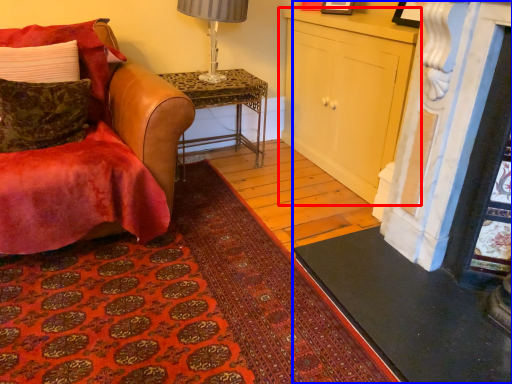
Question: Which point is closer to the camera, cabinetry (highlighted by a red box) or fireplace (highlighted by a blue box)?

Choices:
 (A) cabinetry
 (B) fireplace

Answer: (B)